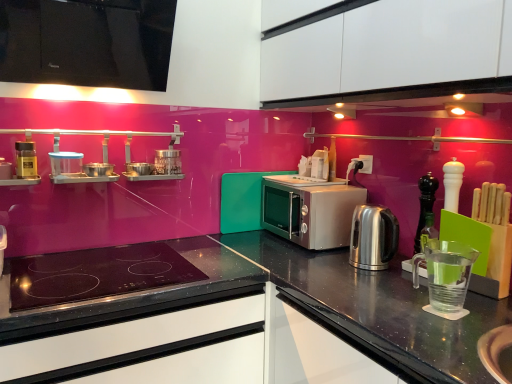
Question: Can you confirm if matte black spice jar at left, which appears as the second appliance when viewed from the left, is positioned to the left of transparent plastic measuring cup at right, the first appliance from the right?

Choices:
 (A) no
 (B) yes

Answer: (B)

Question: Is matte black spice jar at left, the 1th appliance viewed from the top, behind transparent plastic measuring cup at right, which is the first appliance from bottom to top?

Choices:
 (A) no
 (B) yes

Answer: (B)

Question: Considering the relative positions of matte black spice jar at left, which is counted as the 3th appliance, starting from the right, and transparent plastic measuring cup at right, the first appliance from the right, in the image provided, is matte black spice jar at left, which is counted as the 3th appliance, starting from the right, to the right of transparent plastic measuring cup at right, the first appliance from the right, from the viewer's perspective?

Choices:
 (A) no
 (B) yes

Answer: (A)

Question: From the image's perspective, would you say matte black spice jar at left, the 1th appliance viewed from the top, is shown under transparent plastic measuring cup at right, which is the first appliance from bottom to top?

Choices:
 (A) no
 (B) yes

Answer: (A)

Question: From a real-world perspective, does matte black spice jar at left, which is the fourth appliance in bottom-to-top order, stand above transparent plastic measuring cup at right, the first appliance from the right?

Choices:
 (A) yes
 (B) no

Answer: (A)

Question: Considering the relative sizes of matte black spice jar at left, which is the fourth appliance in bottom-to-top order, and transparent plastic measuring cup at right, the first appliance from the right, in the image provided, is matte black spice jar at left, which is the fourth appliance in bottom-to-top order, taller than transparent plastic measuring cup at right, the first appliance from the right,?

Choices:
 (A) no
 (B) yes

Answer: (A)

Question: Considering the relative sizes of matte black spice container at left, which appears as the third appliance when viewed from the top, and black glossy cabinet at upper left, placed as the second cabinetry when sorted from right to left, in the image provided, is matte black spice container at left, which appears as the third appliance when viewed from the top, thinner than black glossy cabinet at upper left, placed as the second cabinetry when sorted from right to left,?

Choices:
 (A) no
 (B) yes

Answer: (B)

Question: Is the position of matte black spice container at left, arranged as the fourth appliance when viewed from the right, more distant than that of black glossy cabinet at upper left, positioned as the 1th cabinetry in left-to-right order?

Choices:
 (A) no
 (B) yes

Answer: (B)

Question: Does matte black spice container at left, arranged as the fourth appliance when viewed from the right, have a greater height compared to black glossy cabinet at upper left, placed as the second cabinetry when sorted from right to left?

Choices:
 (A) yes
 (B) no

Answer: (B)

Question: Is matte black spice container at left, arranged as the fourth appliance when viewed from the right, to the right of black glossy cabinet at upper left, positioned as the 1th cabinetry in left-to-right order, from the viewer's perspective?

Choices:
 (A) no
 (B) yes

Answer: (A)

Question: Is black glossy cabinet at upper left, positioned as the 1th cabinetry in left-to-right order, located within matte black spice container at left, which appears as the 2th appliance when ordered from the bottom?

Choices:
 (A) no
 (B) yes

Answer: (A)

Question: Can you confirm if matte black spice container at left, the 1th appliance when ordered from left to right, is positioned to the left of black glossy cabinet at upper left, positioned as the 1th cabinetry in left-to-right order?

Choices:
 (A) yes
 (B) no

Answer: (A)

Question: Is transparent plastic measuring cup at right, the first appliance from the right, wider than satin silver microwave at center?

Choices:
 (A) yes
 (B) no

Answer: (B)